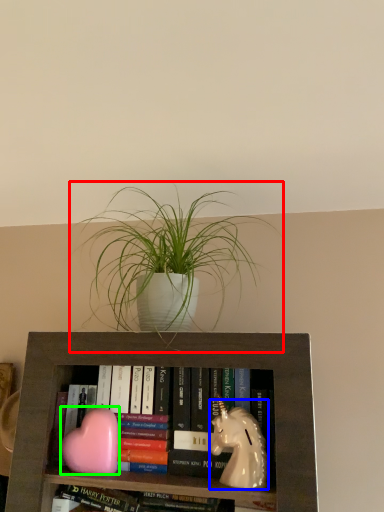
Question: Which object is the farthest from houseplant (highlighted by a red box)? Choose among these: animal (highlighted by a blue box) or animal (highlighted by a green box).

Choices:
 (A) animal
 (B) animal

Answer: (B)